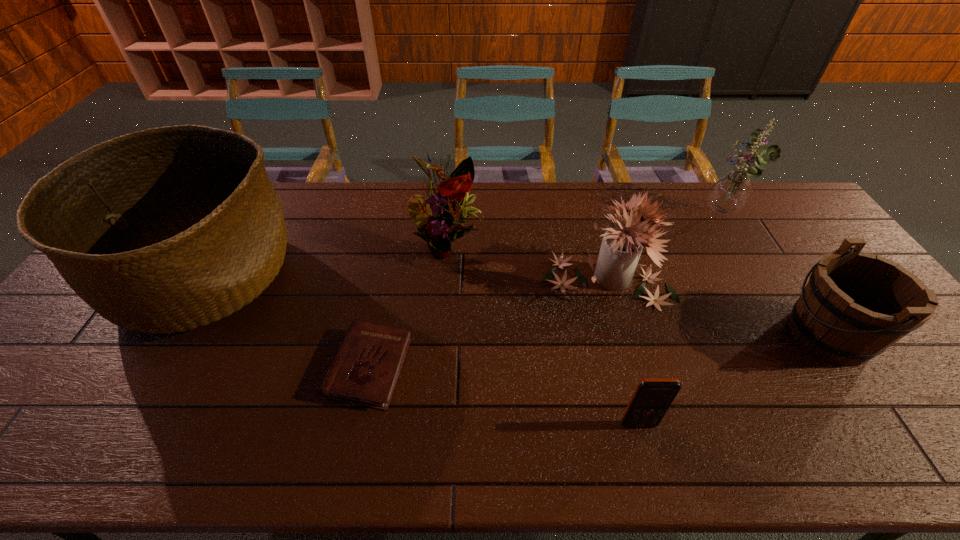
This screenshot has height=540, width=960. I want to click on free space located 0.330m on the front-facing side of the rightmost bouquet, so click(x=607, y=215).

Identify the location of free space located on the front-facing side of the rightmost bouquet. (615, 215).

The width and height of the screenshot is (960, 540). Identify the location of vacant area situated on the front-facing side of the leftmost bouquet. (444, 296).

The height and width of the screenshot is (540, 960). Find the location of `vacant space positioned 0.150m on the right of the second bouquet from left to right`. vacant space positioned 0.150m on the right of the second bouquet from left to right is located at coordinates (722, 281).

Find the location of a particular element. This screenshot has width=960, height=540. free space located on the side of the wine bucket with the handle for carrying is located at coordinates (685, 335).

In order to click on vacant space located on the side of the wine bucket with the handle for carrying in this screenshot , I will do `click(712, 335)`.

This screenshot has height=540, width=960. Identify the location of vacant area located 0.120m on the side of the wine bucket with the handle for carrying. (739, 335).

The image size is (960, 540). What are the coordinates of `vacant point located 0.070m on the screen of the nearest object` in the screenshot? It's located at (648, 461).

This screenshot has height=540, width=960. I want to click on vacant space located 0.120m on the front of the shortest object, so click(x=350, y=464).

The width and height of the screenshot is (960, 540). Identify the location of basket that is at the far edge. (171, 228).